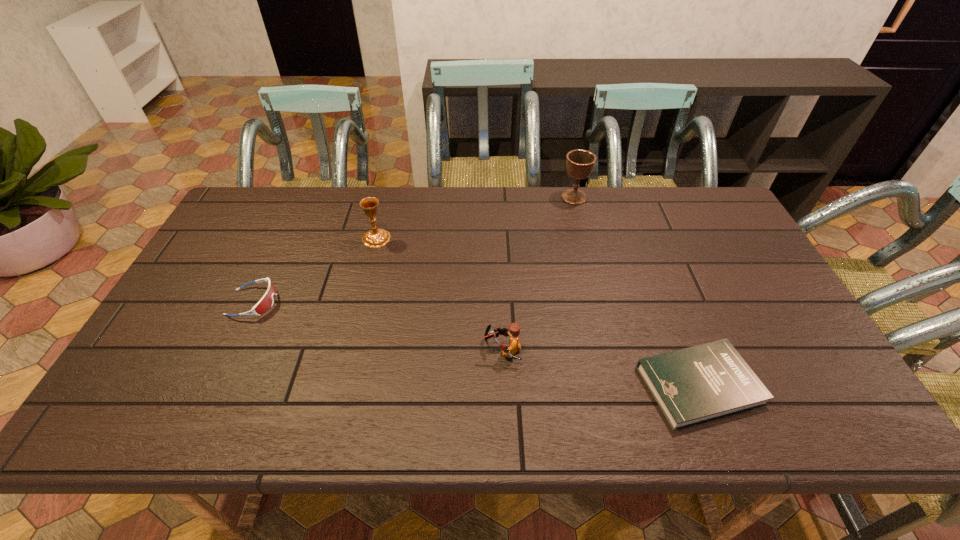
In the image, there is a desktop. Where is `free space at the left edge`? free space at the left edge is located at coordinates (220, 268).

The image size is (960, 540). Find the location of `vacant space at the right edge of the desktop`. vacant space at the right edge of the desktop is located at coordinates (726, 251).

I want to click on free spot at the far left corner of the desktop, so tap(248, 211).

Find the location of a particular element. The height and width of the screenshot is (540, 960). vacant space at the far right corner of the desktop is located at coordinates (710, 189).

This screenshot has width=960, height=540. I want to click on free space between the farther chalice and the third tallest object, so click(x=539, y=273).

Locate an element on the screen. The image size is (960, 540). free spot between the leftmost object and the right chalice is located at coordinates (414, 249).

At what (x,y) coordinates should I click in order to perform the action: click on vacant region between the third farthest object and the third tallest object. Please return your answer as a coordinate pair (x, y). Looking at the image, I should click on (378, 326).

Find the location of a particular element. vacant point located between the third object from left to right and the book is located at coordinates 601,367.

Identify the location of blank region between the book and the farthest object. (636, 291).

Where is `free space between the left chalice and the third nearest object`? free space between the left chalice and the third nearest object is located at coordinates (315, 270).